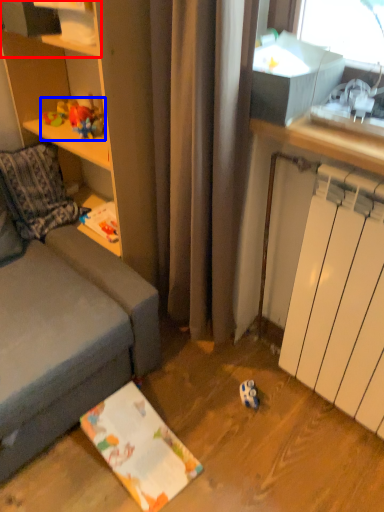
Question: Which object appears closest to the camera in this image, shelf (highlighted by a red box) or toy (highlighted by a blue box)?

Choices:
 (A) shelf
 (B) toy

Answer: (A)